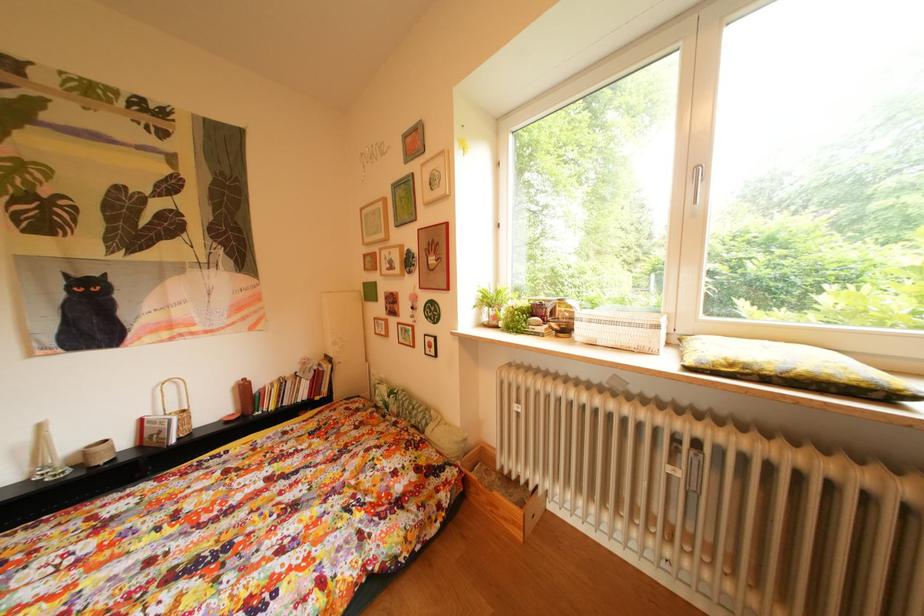
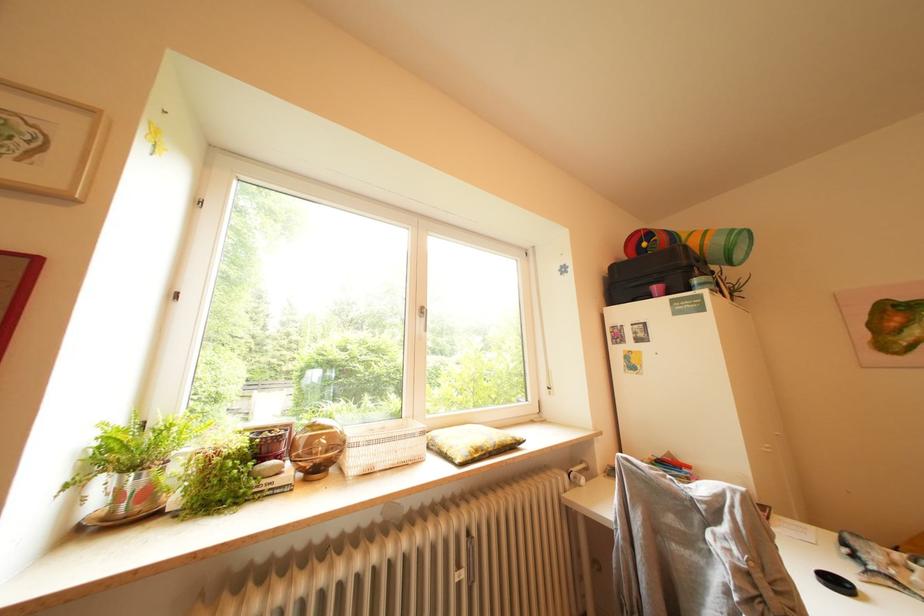
First-person continuous shooting, in which direction is the camera rotating?

The rotation direction of the camera is right-up.